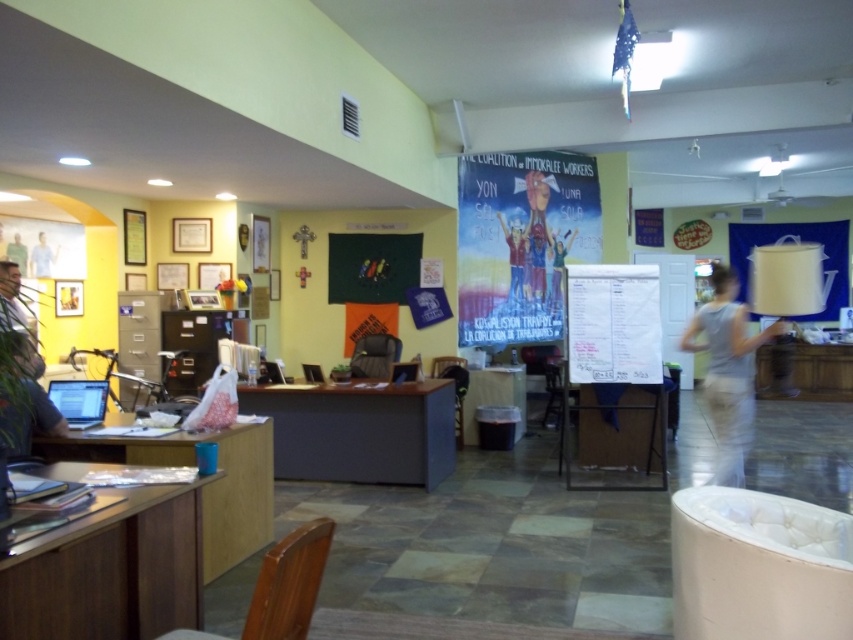
You are standing at the entrance of the community center and need to locate the brown wood table at lower left. According to the coordinates provided, where should you look to find it?

The brown wood table at lower left is located at point (109, 570).

You are organizing a community event and need to place a large poster on the matte black bulletin board at center. The poster is 2 meters wide. Can the poster fit on the bulletin board if the matte plastic table at center is only 1.5 meters wide?

The matte black bulletin board at center is wider than the matte plastic table at center, so the poster that is 2 meters wide can fit on the bulletin board since it is wider than the table.

You are a visitor at this community center and want to ask the person at the desk a question. Which item, the white fabric dress at right or the light blue shirt at left, is closer to you as you approach the desk?

The white fabric dress at right is closer to you because it is in front of the light blue shirt at left.